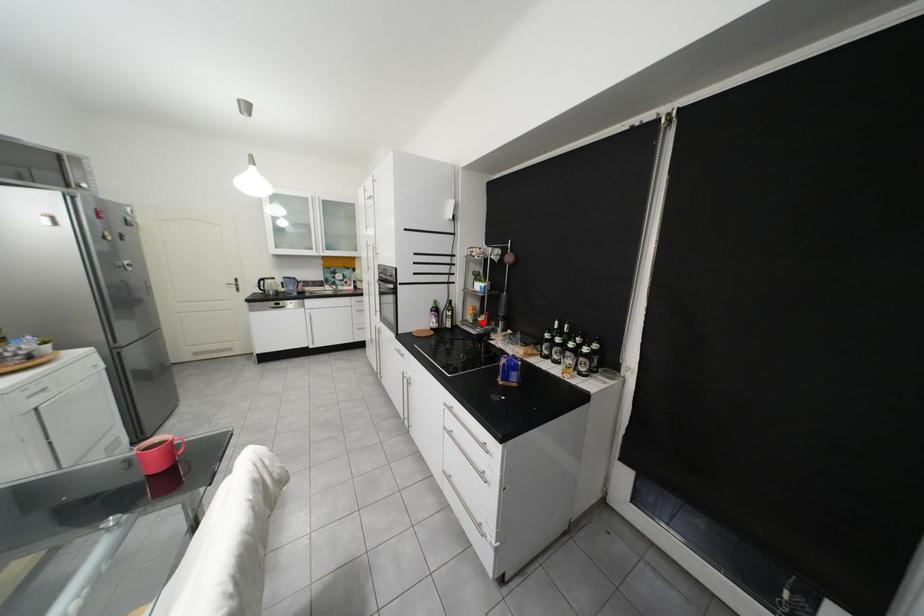
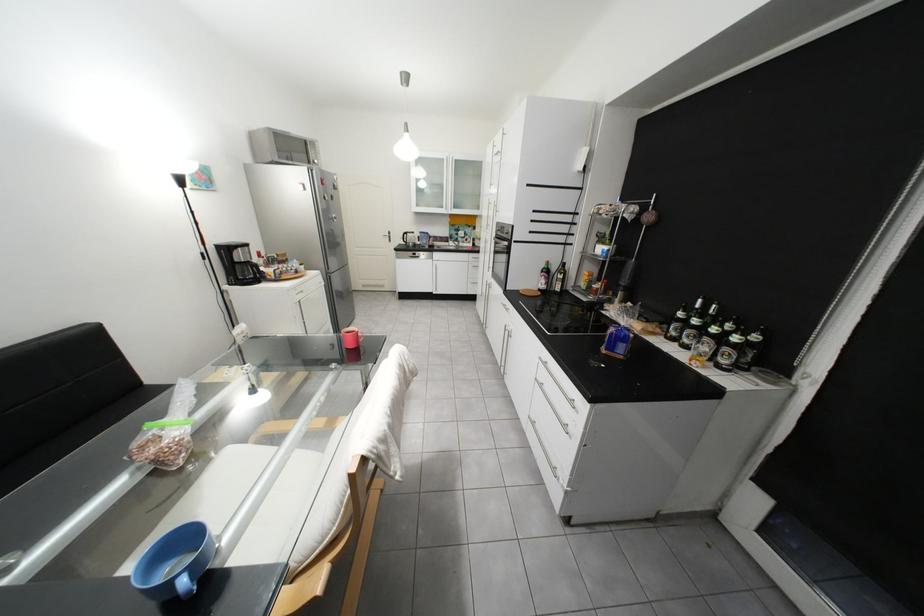
Question: I am providing you with two images of the same scene from different viewpoints. In image1, a red point is highlighted. Considering the same 3D point in image2, which of the following is correct?

Choices:
 (A) It is closer
 (B) It is farther

Answer: (A)